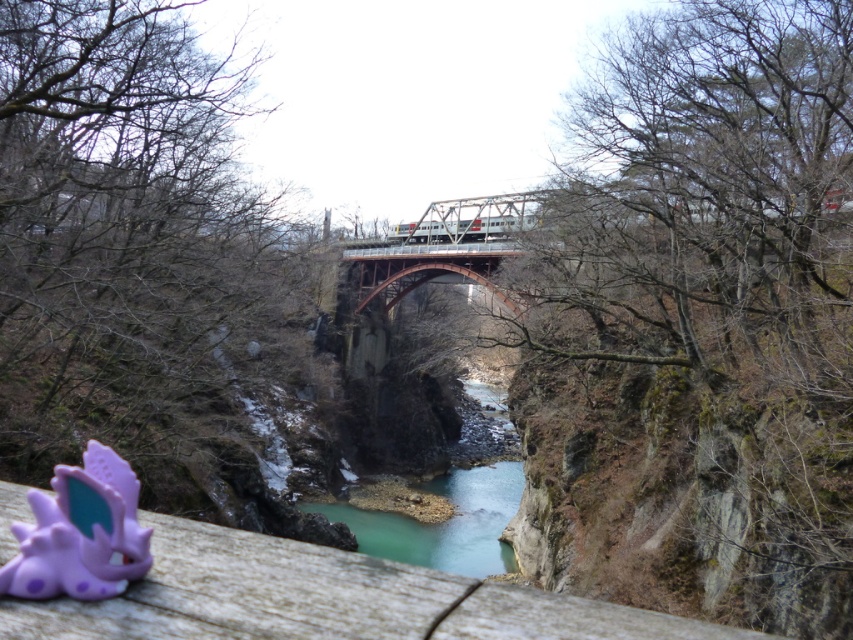
Who is shorter, wooden ledge at lower left or teal smooth water at center?

wooden ledge at lower left is shorter.

Measure the distance between wooden ledge at lower left and teal smooth water at center.

The distance of wooden ledge at lower left from teal smooth water at center is 193.41 feet.

I want to click on wooden ledge at lower left, so click(x=323, y=598).

Who is positioned more to the right, purple matte toy at lower left or teal smooth water at center?

From the viewer's perspective, teal smooth water at center appears more on the right side.

This screenshot has width=853, height=640. Describe the element at coordinates (80, 532) in the screenshot. I see `purple matte toy at lower left` at that location.

At what (x,y) coordinates should I click in order to perform the action: click on purple matte toy at lower left. Please return your answer as a coordinate pair (x, y). Image resolution: width=853 pixels, height=640 pixels. Looking at the image, I should click on (80, 532).

How much distance is there between wooden ledge at lower left and purple matte toy at lower left?

2.10 meters

Describe the element at coordinates (323, 598) in the screenshot. This screenshot has height=640, width=853. I see `wooden ledge at lower left` at that location.

Between point (407, 593) and point (79, 548), which one is positioned behind?

Positioned behind is point (79, 548).

Identify the location of wooden ledge at lower left. The width and height of the screenshot is (853, 640). (323, 598).